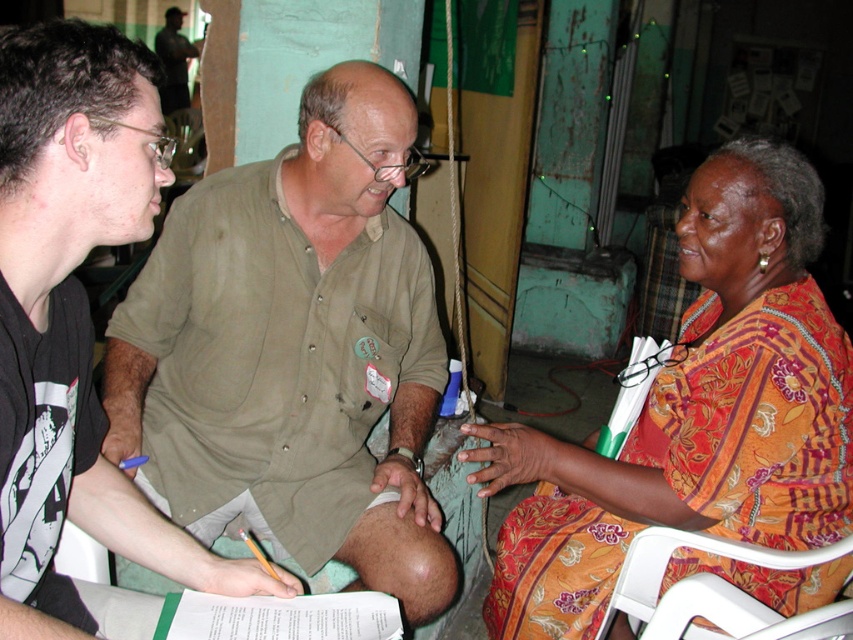
Does floral print fabric at right have a lesser height compared to green matte shirt at left?

In fact, floral print fabric at right may be taller than green matte shirt at left.

Is point (643, 508) closer to viewer compared to point (30, 188)?

No.

Locate an element on the screen. The width and height of the screenshot is (853, 640). floral print fabric at right is located at coordinates (695, 412).

Between green cotton shirt at center and green matte shirt at left, which one appears on the right side from the viewer's perspective?

From the viewer's perspective, green cotton shirt at center appears more on the right side.

Which is behind, point (392, 584) or point (155, 552)?

Positioned behind is point (392, 584).

Image resolution: width=853 pixels, height=640 pixels. Find the location of `green cotton shirt at center`. green cotton shirt at center is located at coordinates (294, 349).

Does floral print fabric at right appear on the right side of white plastic folding chair at lower right?

Incorrect, floral print fabric at right is not on the right side of white plastic folding chair at lower right.

Is floral print fabric at right further to camera compared to white plastic folding chair at lower right?

Yes.

Is point (697, 186) positioned behind point (724, 589)?

That is True.

The height and width of the screenshot is (640, 853). Identify the location of floral print fabric at right. (695, 412).